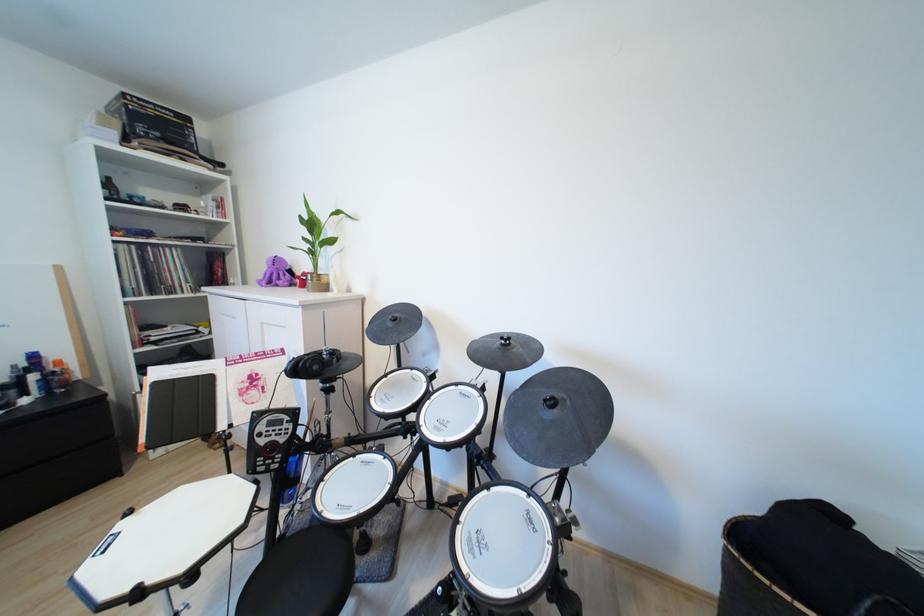
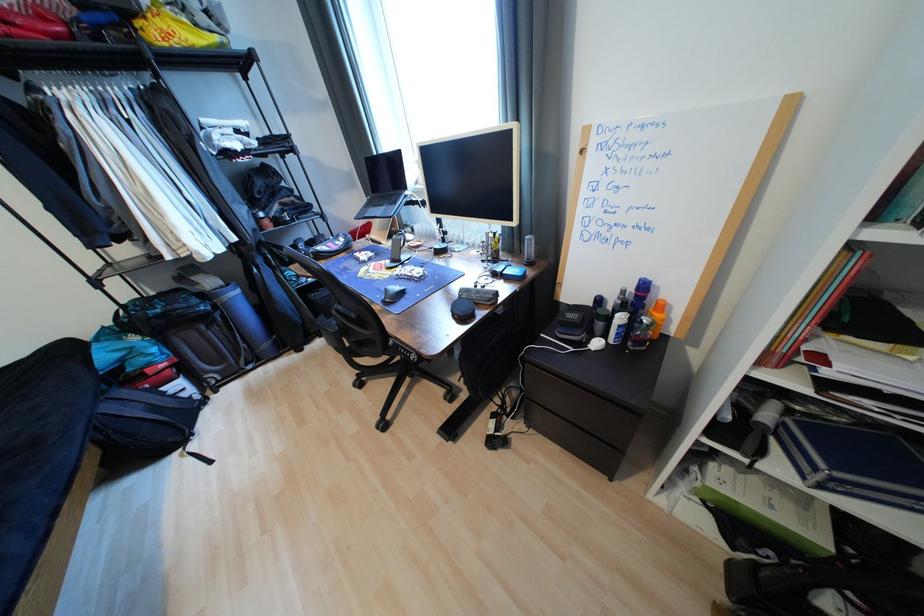
Find the pixel in the second image that matches point (41, 379) in the first image.

(627, 320)